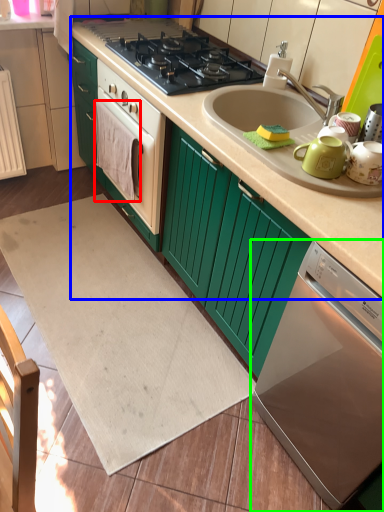
Question: Which object is positioned closest to blanket (highlighted by a red box)? Select from counter top (highlighted by a blue box) and home appliance (highlighted by a green box).

Choices:
 (A) counter top
 (B) home appliance

Answer: (A)